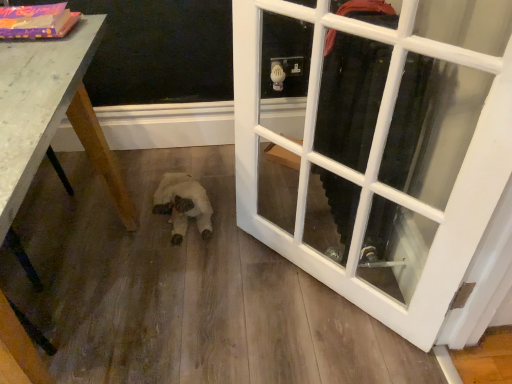
Question: Is white glass door at center positioned far away from white plush toy at center?

Choices:
 (A) yes
 (B) no

Answer: (B)

Question: Can you confirm if white glass door at center is bigger than white plush toy at center?

Choices:
 (A) no
 (B) yes

Answer: (B)

Question: From a real-world perspective, is white glass door at center positioned over white plush toy at center based on gravity?

Choices:
 (A) no
 (B) yes

Answer: (B)

Question: From the image's perspective, is white glass door at center located above white plush toy at center?

Choices:
 (A) no
 (B) yes

Answer: (B)

Question: Is white glass door at center in front of white plush toy at center?

Choices:
 (A) yes
 (B) no

Answer: (A)

Question: Is white glass door at center looking in the opposite direction of white plush toy at center?

Choices:
 (A) no
 (B) yes

Answer: (A)

Question: Is white plush toy at center aimed at wooden table at lower left?

Choices:
 (A) yes
 (B) no

Answer: (B)

Question: Does white plush toy at center appear on the right side of wooden table at lower left?

Choices:
 (A) yes
 (B) no

Answer: (A)

Question: Is white plush toy at center bigger than wooden table at lower left?

Choices:
 (A) no
 (B) yes

Answer: (A)

Question: Is white plush toy at center outside wooden table at lower left?

Choices:
 (A) no
 (B) yes

Answer: (B)

Question: Is white plush toy at center taller than wooden table at lower left?

Choices:
 (A) no
 (B) yes

Answer: (A)

Question: Considering the relative sizes of white plush toy at center and wooden table at lower left in the image provided, is white plush toy at center wider than wooden table at lower left?

Choices:
 (A) no
 (B) yes

Answer: (A)

Question: From the image's perspective, is wooden table at lower left located above white plush toy at center?

Choices:
 (A) no
 (B) yes

Answer: (A)